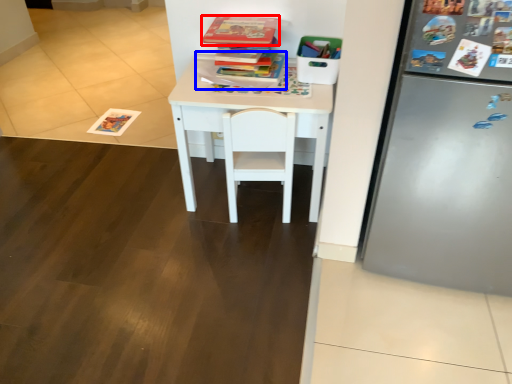
Question: Which point is closer to the camera, book (highlighted by a red box) or book (highlighted by a blue box)?

Choices:
 (A) book
 (B) book

Answer: (A)